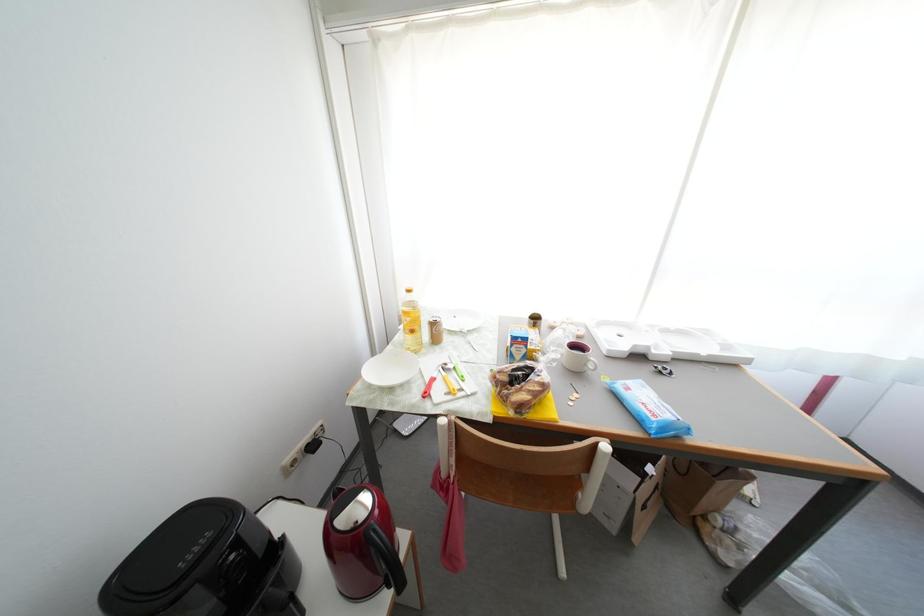
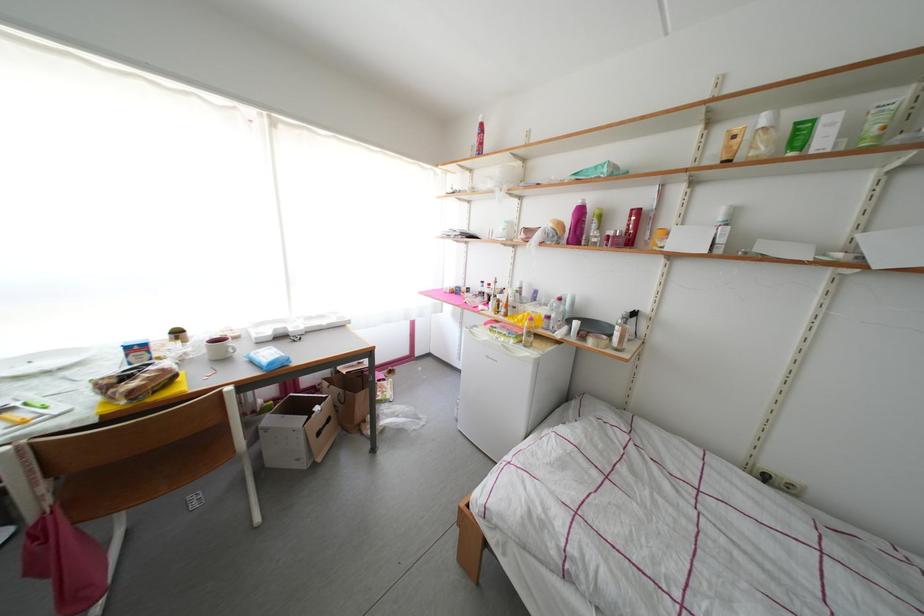
Question: The images are taken continuously from a first-person perspective. In which direction is your viewpoint rotating?

Choices:
 (A) Left
 (B) Right
 (C) Up
 (D) Down

Answer: (B)